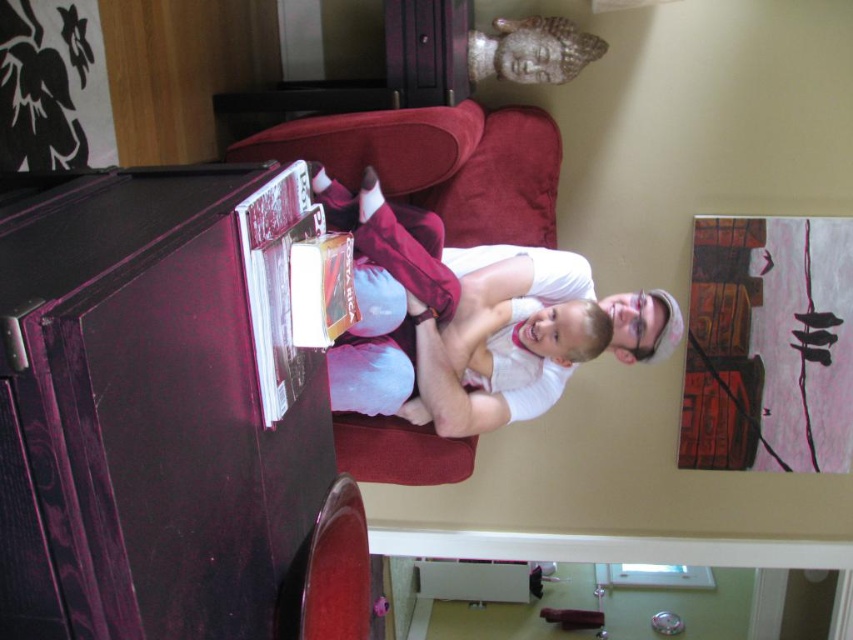
Question: Does white cotton shirt at center appear on the left side of velvet red couch at center?

Choices:
 (A) yes
 (B) no

Answer: (B)

Question: Which object appears closest to the camera in this image?

Choices:
 (A) matte black dresser at left
 (B) white cotton shirt at center
 (C) hardcover book at center

Answer: (A)

Question: Is the position of white cotton shirt at center more distant than that of hardcover book at center?

Choices:
 (A) no
 (B) yes

Answer: (B)

Question: Which of the following is the farthest from the observer?

Choices:
 (A) (123, 189)
 (B) (317, 323)
 (C) (384, 339)
 (D) (256, 157)

Answer: (D)

Question: Is matte black dresser at left below hardcover book at center?

Choices:
 (A) no
 (B) yes

Answer: (B)

Question: Estimate the real-world distances between objects in this image. Which object is closer to the hardcover book at center?

Choices:
 (A) velvet red couch at center
 (B) matte black dresser at left

Answer: (B)